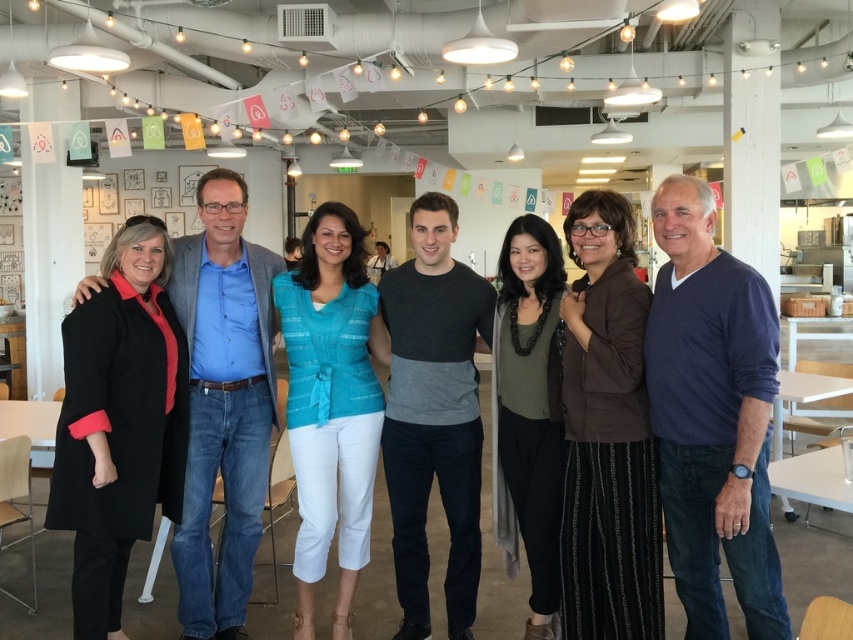
Is dark blue sweater at right smaller than black matte coat at left?

Indeed, dark blue sweater at right has a smaller size compared to black matte coat at left.

Image resolution: width=853 pixels, height=640 pixels. Find the location of `dark blue sweater at right`. dark blue sweater at right is located at coordinates (712, 417).

Does black matte coat at left have a lesser height compared to black cotton shirt at center?

No, black matte coat at left is not shorter than black cotton shirt at center.

Does black matte coat at left have a larger size compared to black cotton shirt at center?

Incorrect, black matte coat at left is not larger than black cotton shirt at center.

Does point (234, 628) come closer to viewer compared to point (474, 476)?

No, it is not.

You are a GUI agent. You are given a task and a screenshot of the screen. Output one action in this format:
    pyautogui.click(x=<x>, y=<y>)
    Task: Click on the black matte coat at left
    This screenshot has height=640, width=853.
    Given the screenshot: What is the action you would take?
    pyautogui.click(x=223, y=403)

Does dark blue sweater at right appear over black cotton shirt at center?

Indeed, dark blue sweater at right is positioned over black cotton shirt at center.

Is dark blue sweater at right closer to camera compared to black cotton shirt at center?

Yes, dark blue sweater at right is in front of black cotton shirt at center.

Which is behind, point (758, 449) or point (453, 220)?

Positioned behind is point (453, 220).

Locate an element on the screen. This screenshot has width=853, height=640. dark blue sweater at right is located at coordinates 712,417.